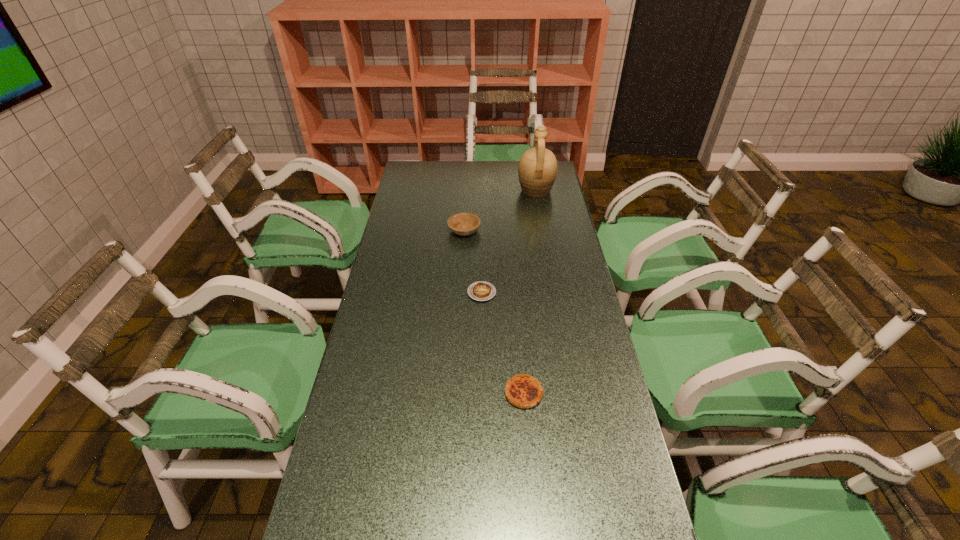
Locate an element on the screen. Image resolution: width=960 pixels, height=540 pixels. unoccupied area between the second shortest object and the left quiche is located at coordinates (503, 343).

Locate an element on the screen. The image size is (960, 540). vacant area that lies between the third shortest object and the farthest object is located at coordinates (500, 211).

The height and width of the screenshot is (540, 960). In order to click on empty space between the shortest object and the second farthest object in this screenshot , I will do `click(473, 261)`.

Identify the location of unoccupied area between the taller quiche and the tallest object. (530, 292).

Find the location of a particular element. The width and height of the screenshot is (960, 540). free space between the second farthest object and the shorter quiche is located at coordinates 473,261.

Locate an element on the screen. This screenshot has height=540, width=960. unoccupied position between the bowl and the third farthest object is located at coordinates (473, 261).

At what (x,y) coordinates should I click in order to perform the action: click on free spot between the pitcher and the nearest object. Please return your answer as a coordinate pair (x, y). This screenshot has height=540, width=960. Looking at the image, I should click on (530, 292).

Where is `free area in between the farther quiche and the pitcher`? This screenshot has width=960, height=540. free area in between the farther quiche and the pitcher is located at coordinates 509,241.

Identify the location of vacant area that lies between the second farthest object and the pitcher. The image size is (960, 540). (500, 211).

Identify which object is the nearest to the pitcher. Please provide its 2D coordinates. Your answer should be formatted as a tuple, i.e. [(x, y)], where the tuple contains the x and y coordinates of a point satisfying the conditions above.

[(463, 223)]